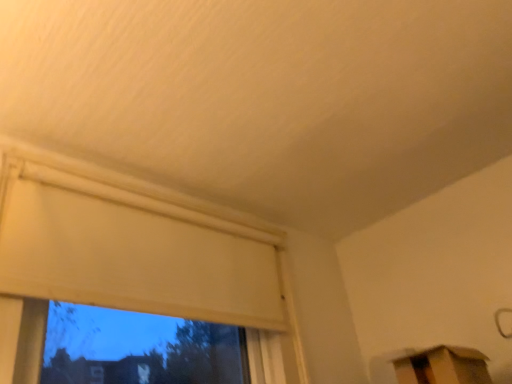
Question: Is matte white window at upper left thinner than cardboard box at lower right?

Choices:
 (A) yes
 (B) no

Answer: (A)

Question: Is matte white window at upper left facing away from cardboard box at lower right?

Choices:
 (A) no
 (B) yes

Answer: (A)

Question: Considering the relative sizes of matte white window at upper left and cardboard box at lower right in the image provided, is matte white window at upper left bigger than cardboard box at lower right?

Choices:
 (A) yes
 (B) no

Answer: (A)

Question: Is matte white window at upper left at the right side of cardboard box at lower right?

Choices:
 (A) no
 (B) yes

Answer: (A)

Question: Can you confirm if matte white window at upper left is smaller than cardboard box at lower right?

Choices:
 (A) yes
 (B) no

Answer: (B)

Question: Could you tell me if matte white window at upper left is facing cardboard box at lower right?

Choices:
 (A) no
 (B) yes

Answer: (A)

Question: From a real-world perspective, is cardboard box at lower right on matte white window at upper left?

Choices:
 (A) yes
 (B) no

Answer: (B)

Question: Could matte white window at upper left be considered to be inside cardboard box at lower right?

Choices:
 (A) yes
 (B) no

Answer: (B)

Question: From the image's perspective, is cardboard box at lower right under matte white window at upper left?

Choices:
 (A) no
 (B) yes

Answer: (B)

Question: Considering the relative sizes of cardboard box at lower right and matte white window at upper left in the image provided, is cardboard box at lower right bigger than matte white window at upper left?

Choices:
 (A) no
 (B) yes

Answer: (A)

Question: Considering the relative sizes of cardboard box at lower right and matte white window at upper left in the image provided, is cardboard box at lower right thinner than matte white window at upper left?

Choices:
 (A) no
 (B) yes

Answer: (A)

Question: Is cardboard box at lower right closer to camera compared to matte white window at upper left?

Choices:
 (A) no
 (B) yes

Answer: (A)

Question: Considering the positions of matte white window at upper left and cardboard box at lower right in the image, is matte white window at upper left bigger or smaller than cardboard box at lower right?

Choices:
 (A) big
 (B) small

Answer: (A)